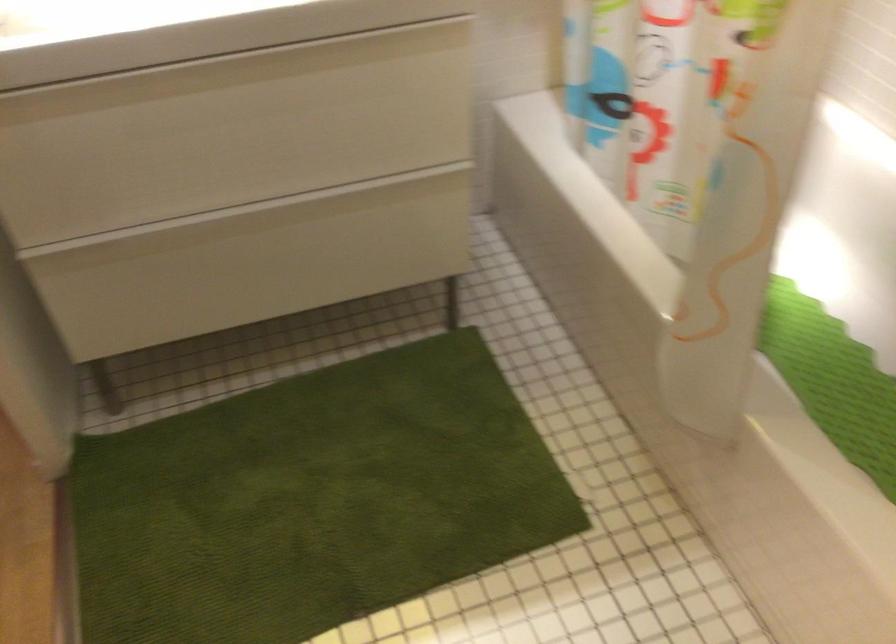
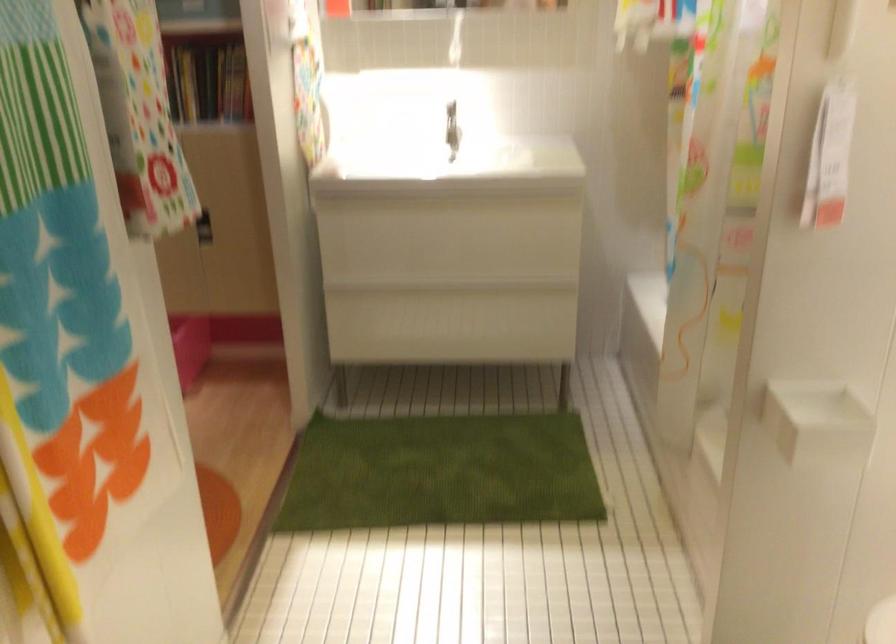
Which direction would the cameraman need to move to produce the second image?

The cameraman walked toward right, backward.